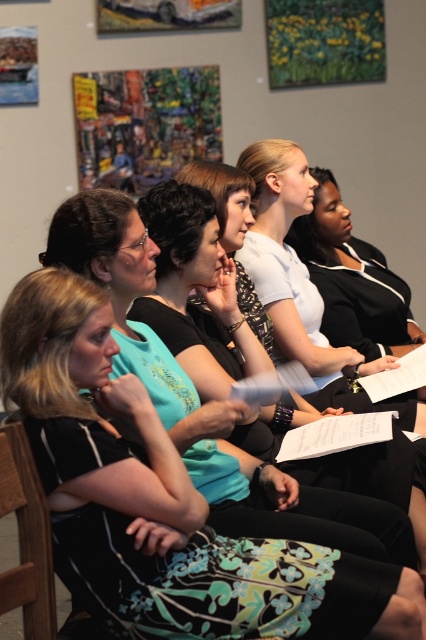
Which of these two, matte black dress at center or white matte shirt at center, stands shorter?

Standing shorter between the two is matte black dress at center.

Which is behind, point (331, 630) or point (267, 148)?

The point (267, 148) is behind.

Locate an element on the screen. matte black dress at center is located at coordinates (163, 500).

Between white matte shirt at center and wooden at left, which one is positioned higher?

white matte shirt at center

Does white matte shirt at center appear under wooden at left?

Incorrect, white matte shirt at center is not positioned below wooden at left.

Does point (268, 282) come behind point (37, 550)?

That is True.

The image size is (426, 640). In order to click on white matte shirt at center in this screenshot , I will do `click(291, 268)`.

Who is more distant from viewer, (163, 621) or (11, 472)?

Positioned behind is point (11, 472).

Can you confirm if matte black dress at center is positioned to the right of wooden at left?

Yes, matte black dress at center is to the right of wooden at left.

You are a GUI agent. You are given a task and a screenshot of the screen. Output one action in this format:
    pyautogui.click(x=<x>, y=<y>)
    Task: Click on the matte black dress at center
    Image resolution: width=426 pixels, height=640 pixels.
    Given the screenshot: What is the action you would take?
    [163, 500]